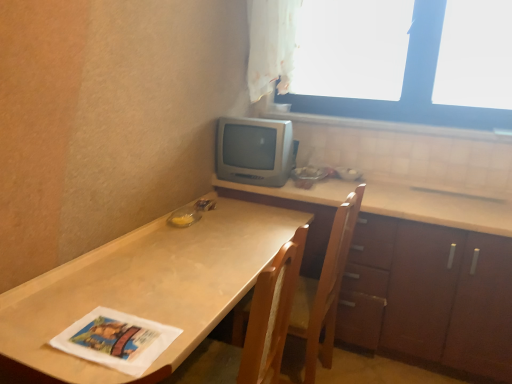
Identify the location of white paper magazine at lower left. This screenshot has height=384, width=512. (116, 340).

Identify the location of transparent plastic window at upper right. (406, 62).

Find the location of `matte brown table at lower left`. matte brown table at lower left is located at coordinates (144, 288).

Where is `white sheer curtain at upper center`? The image size is (512, 384). white sheer curtain at upper center is located at coordinates (272, 45).

Is wooden cabinet at right next to matte brown table at lower left and touching it?

No, wooden cabinet at right is not next to matte brown table at lower left.

From a real-world perspective, which object rests below the other?

matte brown table at lower left is physically lower.

Looking at this image, is wooden cabinet at right inside or outside of matte brown table at lower left?

wooden cabinet at right cannot be found inside matte brown table at lower left.

How different are the orientations of wooden cabinet at right and matte brown table at lower left in degrees?

There is a 90.5-degree angle between the facing directions of wooden cabinet at right and matte brown table at lower left.

Based on the photo, between wooden chair at center and white paper magazine at lower left, which one has larger size?

wooden chair at center.

From a real-world perspective, who is located higher, wooden chair at center or white paper magazine at lower left?

white paper magazine at lower left.

Could you tell me if wooden chair at center is turned towards white paper magazine at lower left?

No, wooden chair at center is not oriented towards white paper magazine at lower left.

In terms of height, does wooden chair at center look taller or shorter compared to white paper magazine at lower left?

wooden chair at center is taller than white paper magazine at lower left.

From the image's perspective, is matte brown table at lower left over white tile at upper right?

No, from the image's perspective, matte brown table at lower left is not on top of white tile at upper right.

Does point (29, 335) lie in front of point (322, 115)?

That is True.

Which object is closer to the camera, matte brown table at lower left or white tile at upper right?

matte brown table at lower left is more forward.

Considering the relative sizes of white tile at upper right and white paper magazine at lower left in the image provided, is white tile at upper right bigger than white paper magazine at lower left?

Yes.

Does white tile at upper right lie behind white paper magazine at lower left?

Yes, white tile at upper right is further from the viewer.

Is point (406, 128) farther from viewer compared to point (93, 313)?

Yes, point (406, 128) is behind point (93, 313).

From a real-world perspective, which object rests below the other?

In real-world perspective, wooden chair at center is lower.

How different are the orientations of white tile at upper right and wooden chair at center in degrees?

The facing directions of white tile at upper right and wooden chair at center are 93 degrees apart.

Is white tile at upper right not close to wooden chair at center?

Yes, white tile at upper right and wooden chair at center are quite far apart.

In terms of height, does white tile at upper right look taller or shorter compared to wooden chair at center?

Clearly, white tile at upper right is shorter compared to wooden chair at center.

Which object is positioned more to the left, silver metallic television at center or white sheer curtain at upper center?

silver metallic television at center is more to the left.

Does silver metallic television at center have a larger size compared to white sheer curtain at upper center?

Incorrect, silver metallic television at center is not larger than white sheer curtain at upper center.

Is silver metallic television at center aimed at white sheer curtain at upper center?

No, silver metallic television at center is not oriented towards white sheer curtain at upper center.

Consider the image. Is white paper magazine at lower left positioned behind white sheer curtain at upper center?

No.

Is white paper magazine at lower left oriented away from white sheer curtain at upper center?

No, white sheer curtain at upper center is not at the back of white paper magazine at lower left.

Considering the sizes of objects white paper magazine at lower left and white sheer curtain at upper center in the image provided, who is smaller, white paper magazine at lower left or white sheer curtain at upper center?

With smaller size is white paper magazine at lower left.

From a real-world perspective, is white paper magazine at lower left located higher than white sheer curtain at upper center?

Incorrect, from a real-world perspective, white paper magazine at lower left is lower than white sheer curtain at upper center.

At what (x,y) coordinates should I click in order to perform the action: click on countertop lying on the left of wooden cabinet at right. Please return your answer as a coordinate pair (x, y). This screenshot has width=512, height=384. Looking at the image, I should click on (144, 288).

The width and height of the screenshot is (512, 384). What are the coordinates of `magazine above the wooden chair at center (from the image's perspective)` in the screenshot? It's located at (116, 340).

Based on their spatial positions, is matte brown table at lower left or wooden cabinet at right further from silver metallic television at center?

matte brown table at lower left.

From the image, which object appears to be farther from white tile at upper right, white sheer curtain at upper center or silver metallic television at center?

silver metallic television at center is positioned further to the anchor white tile at upper right.

Which object lies nearer to the anchor point matte brown table at lower left, wooden chair at center or white paper magazine at lower left?

Based on the image, white paper magazine at lower left appears to be nearer to matte brown table at lower left.

Which object lies further to the anchor point matte brown table at lower left, white paper magazine at lower left or white sheer curtain at upper center?

white sheer curtain at upper center.

Looking at the image, which one is located further to wooden cabinet at right, wooden chair at center or white tile at upper right?

white tile at upper right is positioned further to the anchor wooden cabinet at right.

When comparing their distances from white sheer curtain at upper center, does white paper magazine at lower left or matte brown table at lower left seem further?

white paper magazine at lower left is positioned further to the anchor white sheer curtain at upper center.

Based on the photo, from the image, which object appears to be nearer to white sheer curtain at upper center, silver metallic television at center or wooden cabinet at right?

silver metallic television at center is closer to white sheer curtain at upper center.

From the image, which object appears to be nearer to transparent plastic window at upper right, matte brown table at lower left or white sheer curtain at upper center?

Among the two, white sheer curtain at upper center is located nearer to transparent plastic window at upper right.

The width and height of the screenshot is (512, 384). I want to click on chair between white paper magazine at lower left and silver metallic television at center along the z-axis, so click(x=324, y=290).

The height and width of the screenshot is (384, 512). I want to click on chair located between matte brown table at lower left and white tile at upper right in the depth direction, so click(324, 290).

Find the location of a particular element. This screenshot has width=512, height=384. magazine that lies between white sheer curtain at upper center and matte brown table at lower left from top to bottom is located at coordinates (116, 340).

This screenshot has width=512, height=384. In order to click on curtain located between silver metallic television at center and white tile at upper right in the left-right direction in this screenshot , I will do `click(272, 45)`.